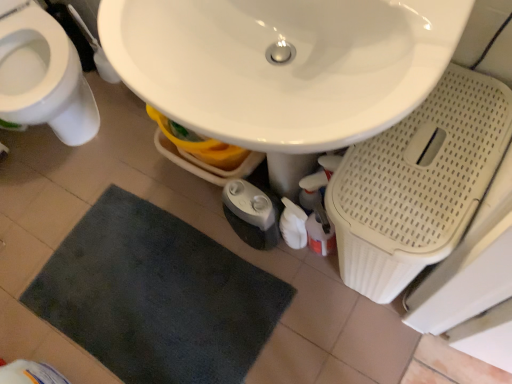
Question: From the image's perspective, is dark gray plush bath mat at lower center positioned above or below white glossy toilet at left?

Choices:
 (A) above
 (B) below

Answer: (B)

Question: Considering their positions, is dark gray plush bath mat at lower center located in front of or behind white glossy toilet at left?

Choices:
 (A) behind
 (B) front

Answer: (A)

Question: Which object is positioned farthest from the dark gray plush bath mat at lower center?

Choices:
 (A) white glossy sink at center
 (B) white glossy toilet at left

Answer: (A)

Question: Estimate the real-world distances between objects in this image. Which object is closer to the dark gray plush bath mat at lower center?

Choices:
 (A) white glossy toilet at left
 (B) white glossy sink at center

Answer: (A)